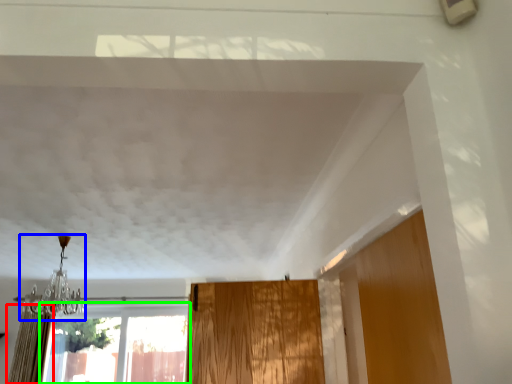
Question: Which object is positioned farthest from curtain (highlighted by a red box)? Select from light fixture (highlighted by a blue box) and window (highlighted by a green box).

Choices:
 (A) light fixture
 (B) window

Answer: (B)